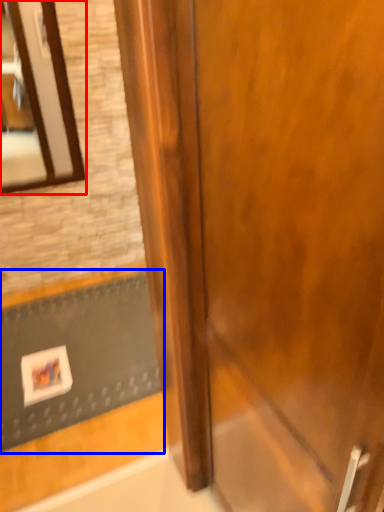
Question: Which object is closer to the camera taking this photo, mirror (highlighted by a red box) or doormat (highlighted by a blue box)?

Choices:
 (A) mirror
 (B) doormat

Answer: (B)